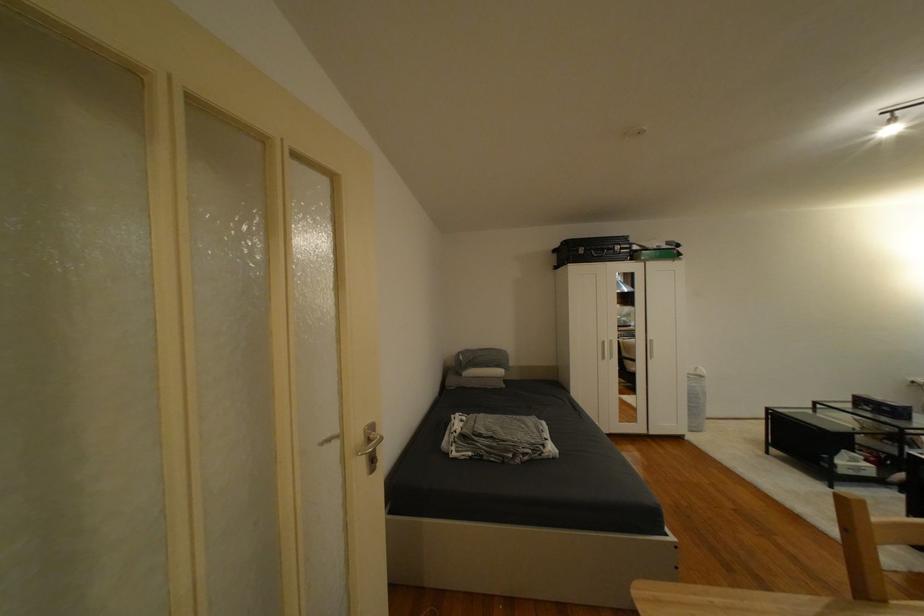
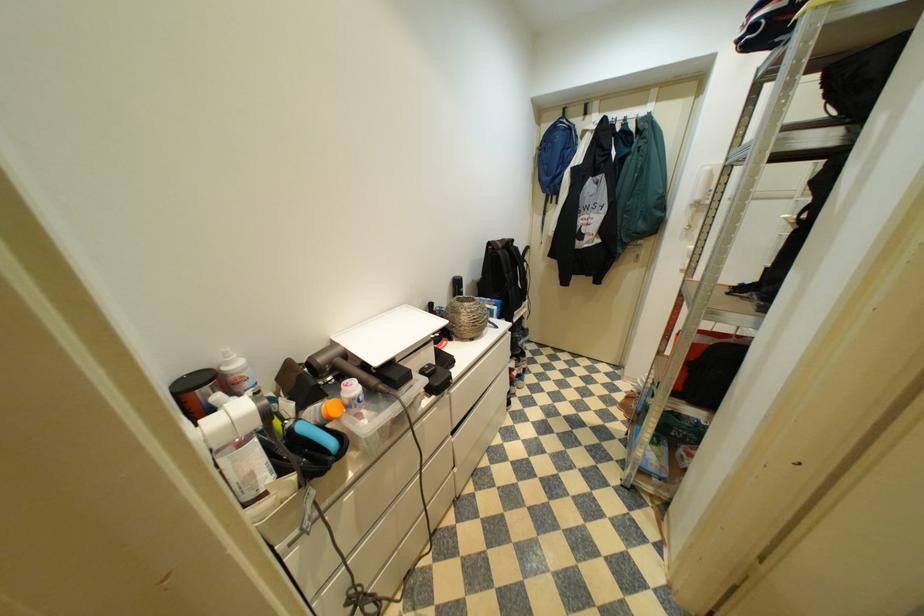
Based on the continuous images, in which direction is the camera rotating?

The camera rotated toward left-down.